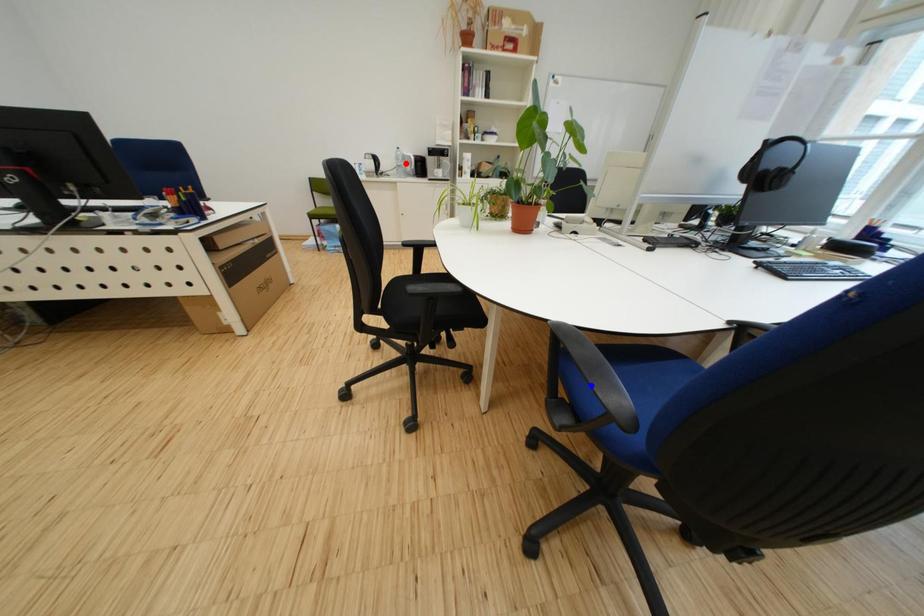
Question: Two points are marked on the image. Which point is closer to the camera?

Choices:
 (A) Blue point is closer.
 (B) Red point is closer.

Answer: (A)